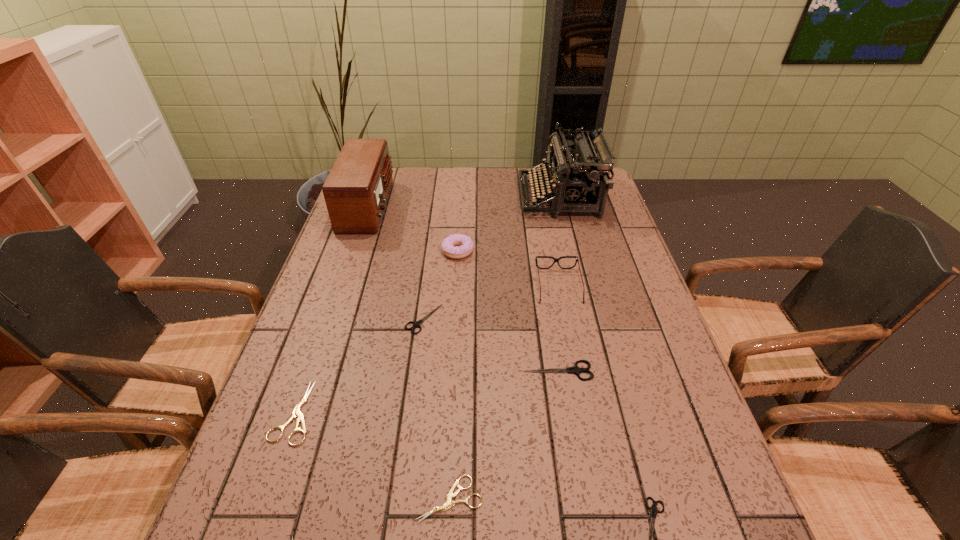
The width and height of the screenshot is (960, 540). Identify the location of the leftmost shears. (296, 412).

Where is `the rightmost beige shears`? the rightmost beige shears is located at coordinates (449, 504).

This screenshot has width=960, height=540. I want to click on the second biggest beige shears, so click(449, 504).

Find the location of a particular element. Image resolution: width=960 pixels, height=540 pixels. free spot located 0.150m on the typing side of the typewriter is located at coordinates (477, 197).

Locate an element on the screen. Image resolution: width=960 pixels, height=540 pixels. vacant space located on the typing side of the typewriter is located at coordinates (477, 197).

This screenshot has height=540, width=960. Identify the location of vacant position located 0.080m on the typing side of the typewriter. (497, 197).

Identify the location of free region located on the front-facing side of the radio receiver. This screenshot has width=960, height=540. (422, 206).

You are a GUI agent. You are given a task and a screenshot of the screen. Output one action in this format:
    pyautogui.click(x=<x>, y=<y>)
    Task: Click on the vacant region located 0.400m with the lenses facing outward on the third tallest object
    The height and width of the screenshot is (540, 960).
    Given the screenshot: What is the action you would take?
    pyautogui.click(x=589, y=450)

You are a GUI agent. You are given a task and a screenshot of the screen. Output one action in this format:
    pyautogui.click(x=<x>, y=<y>)
    Task: Click on the vacant point located on the front of the seventh shortest object
    This screenshot has height=540, width=960.
    Given the screenshot: What is the action you would take?
    pos(455,300)

Image resolution: width=960 pixels, height=540 pixels. What are the coordinates of `vacant space located on the left of the sixth farthest object` in the screenshot? It's located at (415, 371).